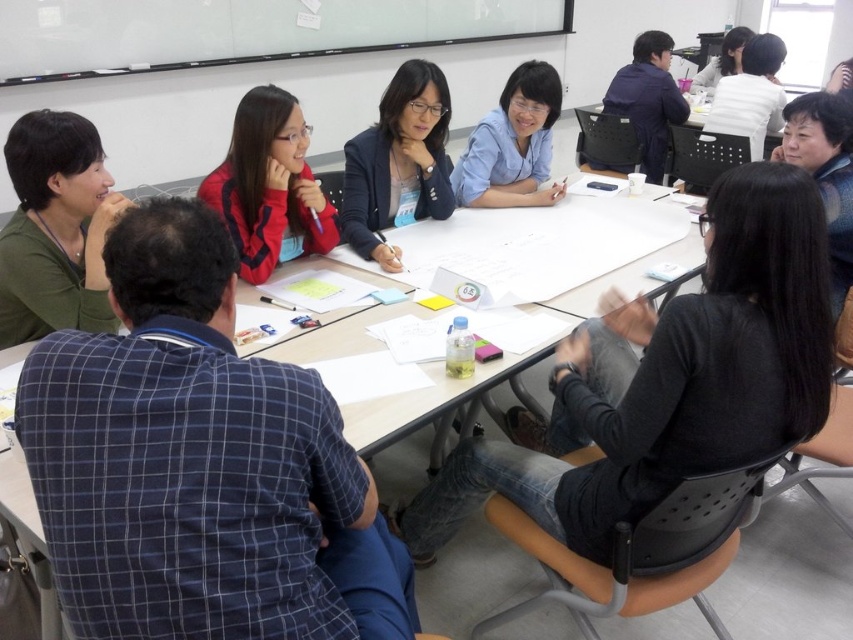
Question: Considering the relative positions of matte red jacket at center and blue matte shirt at center in the image provided, where is matte red jacket at center located with respect to blue matte shirt at center?

Choices:
 (A) right
 (B) left

Answer: (B)

Question: Where is green matte shirt at left located in relation to matte red jacket at center in the image?

Choices:
 (A) left
 (B) right

Answer: (A)

Question: Which object is positioned farthest from the black matte shirt at center?

Choices:
 (A) matte black jacket at upper center
 (B) blue matte shirt at center

Answer: (A)

Question: Does black matte shirt at center have a greater width compared to matte black blazer at center?

Choices:
 (A) no
 (B) yes

Answer: (B)

Question: Among these objects, which one is farthest from the camera?

Choices:
 (A) matte red jacket at center
 (B) matte black blazer at center

Answer: (B)

Question: Which point appears farthest from the camera in this image?

Choices:
 (A) (61, 148)
 (B) (381, 209)
 (C) (461, 481)

Answer: (B)